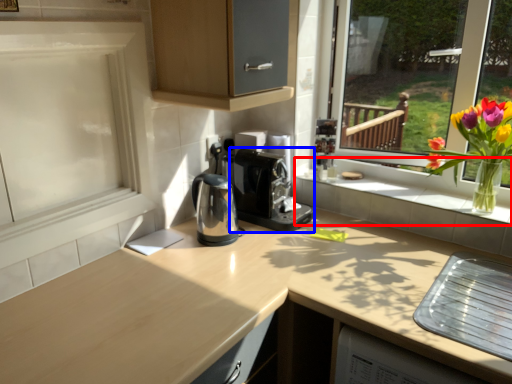
Question: Which point is further to the camera, window sill (highlighted by a red box) or coffee machine (highlighted by a blue box)?

Choices:
 (A) window sill
 (B) coffee machine

Answer: (B)